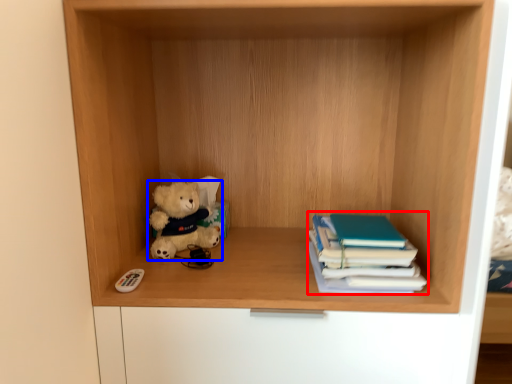
Question: Among these objects, which one is farthest to the camera, book (highlighted by a red box) or teddy bear (highlighted by a blue box)?

Choices:
 (A) book
 (B) teddy bear

Answer: (B)